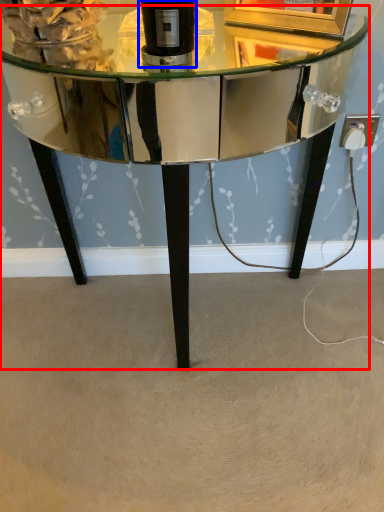
Question: Which of the following is the farthest to the observer, table (highlighted by a red box) or bottle (highlighted by a blue box)?

Choices:
 (A) table
 (B) bottle

Answer: (B)